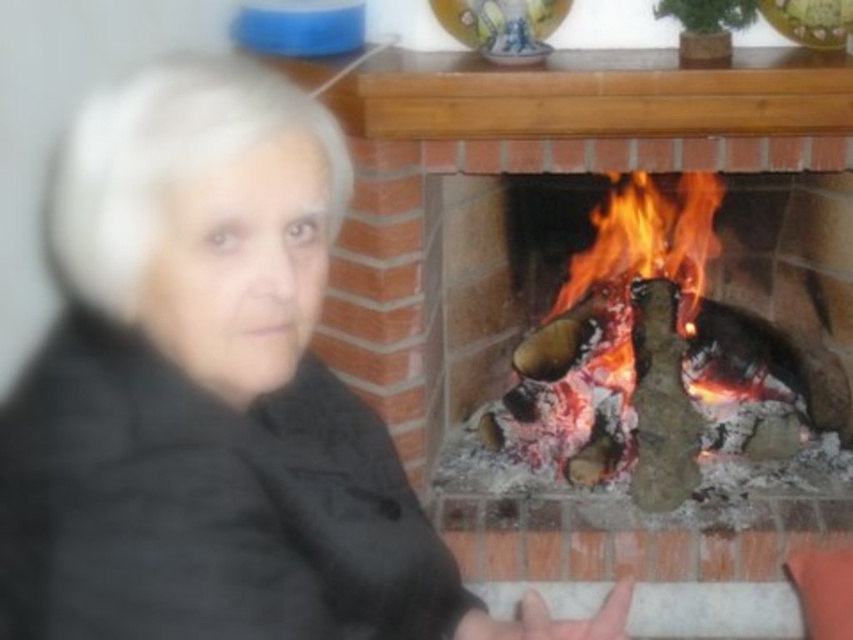
Question: Does black quilted jacket at left have a greater width compared to charred wood fire at center?

Choices:
 (A) no
 (B) yes

Answer: (A)

Question: Which object is closer to the camera taking this photo?

Choices:
 (A) charred wood fire at center
 (B) black quilted jacket at left

Answer: (B)

Question: Does black quilted jacket at left appear on the right side of charred wood fire at center?

Choices:
 (A) no
 (B) yes

Answer: (A)

Question: Which of the following is the farthest from the observer?

Choices:
 (A) (614, 381)
 (B) (79, 188)

Answer: (A)

Question: Observing the image, what is the correct spatial positioning of black quilted jacket at left in reference to charred wood fire at center?

Choices:
 (A) below
 (B) above

Answer: (A)